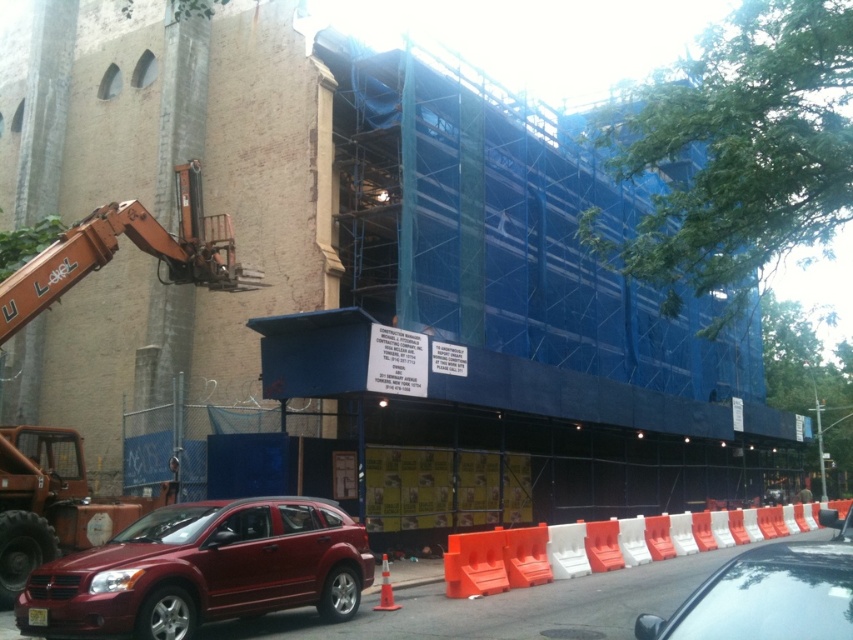
Can you confirm if shiny red suv at lower left is bigger than glossy red car at center?

Actually, shiny red suv at lower left might be smaller than glossy red car at center.

Can you confirm if shiny red suv at lower left is wider than glossy red car at center?

No, shiny red suv at lower left is not wider than glossy red car at center.

Is point (204, 584) farther from camera compared to point (811, 632)?

Yes, point (204, 584) is behind point (811, 632).

This screenshot has height=640, width=853. Find the location of `shiny red suv at lower left`. shiny red suv at lower left is located at coordinates (202, 570).

Does glossy red car at center have a larger size compared to orange plastic barrier at lower right?

Correct, glossy red car at center is larger in size than orange plastic barrier at lower right.

Consider the image. Is glossy red car at center further to the viewer compared to orange plastic barrier at lower right?

No, glossy red car at center is closer to the viewer.

Who is more distant from viewer, (808, 572) or (590, 552)?

The point (590, 552) is behind.

You are a GUI agent. You are given a task and a screenshot of the screen. Output one action in this format:
    pyautogui.click(x=<x>, y=<y>)
    Task: Click on the glossy red car at center
    This screenshot has width=853, height=640.
    Given the screenshot: What is the action you would take?
    pyautogui.click(x=770, y=593)

What do you see at coordinates (202, 570) in the screenshot? I see `shiny red suv at lower left` at bounding box center [202, 570].

Looking at this image, is shiny red suv at lower left above orange plastic barrier at lower right?

Yes, shiny red suv at lower left is above orange plastic barrier at lower right.

What do you see at coordinates (202, 570) in the screenshot? I see `shiny red suv at lower left` at bounding box center [202, 570].

Find the location of a particular element. This screenshot has height=640, width=853. shiny red suv at lower left is located at coordinates (202, 570).